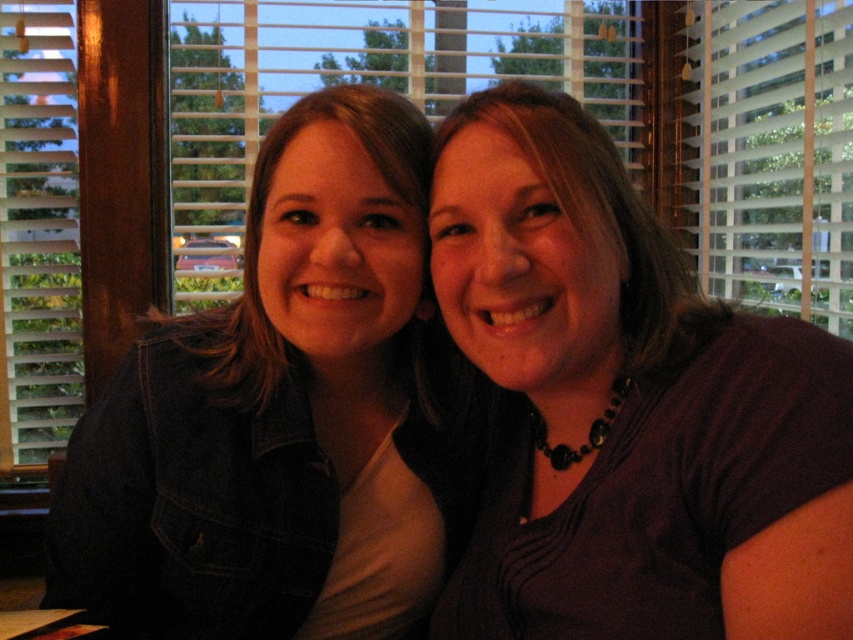
You are a photographer trying to capture a portrait of the two people in the scene. Since you want to ensure that the denim jacket at left and the dark brown hair at center are both clearly visible in the frame, which object should you focus on first to ensure depth of field?

The denim jacket at left should be focused on first because it has a greater height compared to the dark brown hair at center, ensuring both objects remain in focus.

You are taking a photo of two people sitting at a table in a restaurant. The camera is positioned at the same level as their faces. There are two points marked on the table surface, one at coordinates point (425, 472) and the other at point (538, 115). Which point is closer to the camera?

Point (538, 115) is closer to the camera because it is less further than point (425, 472) according to the description.

You are a photographer trying to capture a closeup shot of the denim jacket at left and the dark brown hair at center. Since you want to focus on the details of both items, which one should you adjust the camera focus for first, considering their sizes?

The denim jacket at left is bigger than the dark brown hair at center, so you should focus on the denim jacket at left first because larger objects require more precise focus adjustments to ensure all details are sharp.